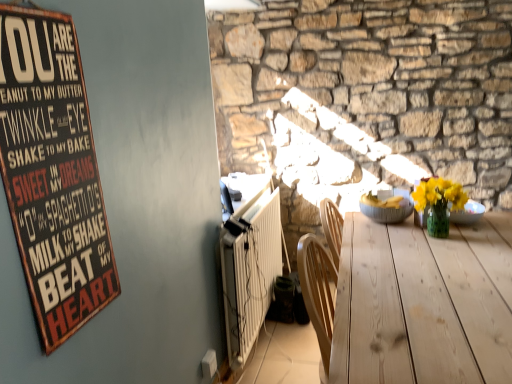
Question: Is white ribbed radiator at lower left not close to wooden signboard at left?

Choices:
 (A) yes
 (B) no

Answer: (A)

Question: Does white ribbed radiator at lower left have a smaller size compared to wooden signboard at left?

Choices:
 (A) yes
 (B) no

Answer: (B)

Question: From a real-world perspective, is white ribbed radiator at lower left beneath wooden signboard at left?

Choices:
 (A) no
 (B) yes

Answer: (B)

Question: Is white ribbed radiator at lower left to the left of wooden signboard at left from the viewer's perspective?

Choices:
 (A) no
 (B) yes

Answer: (A)

Question: Is white ribbed radiator at lower left turned away from wooden signboard at left?

Choices:
 (A) no
 (B) yes

Answer: (A)

Question: Is white ribbed radiator at lower left situated inside wooden signboard at left or outside?

Choices:
 (A) outside
 (B) inside

Answer: (A)

Question: Does point (226, 264) appear closer or farther from the camera than point (48, 208)?

Choices:
 (A) farther
 (B) closer

Answer: (A)

Question: From the image's perspective, is white ribbed radiator at lower left above or below wooden signboard at left?

Choices:
 (A) below
 (B) above

Answer: (A)

Question: From a real-world perspective, is white ribbed radiator at lower left positioned above or below wooden signboard at left?

Choices:
 (A) above
 (B) below

Answer: (B)

Question: Is point (368, 213) positioned closer to the camera than point (244, 324)?

Choices:
 (A) farther
 (B) closer

Answer: (B)

Question: Looking at the image, does gray textured bowl at center seem bigger or smaller compared to white ribbed radiator at lower left?

Choices:
 (A) small
 (B) big

Answer: (A)

Question: Relative to white ribbed radiator at lower left, is gray textured bowl at center in front or behind?

Choices:
 (A) behind
 (B) front

Answer: (A)

Question: From a real-world perspective, is gray textured bowl at center above or below white ribbed radiator at lower left?

Choices:
 (A) above
 (B) below

Answer: (A)

Question: Relative to wooden signboard at left, is gray textured bowl at center in front or behind?

Choices:
 (A) front
 (B) behind

Answer: (B)

Question: Considering the positions of gray textured bowl at center and wooden signboard at left in the image, is gray textured bowl at center wider or thinner than wooden signboard at left?

Choices:
 (A) thin
 (B) wide

Answer: (B)